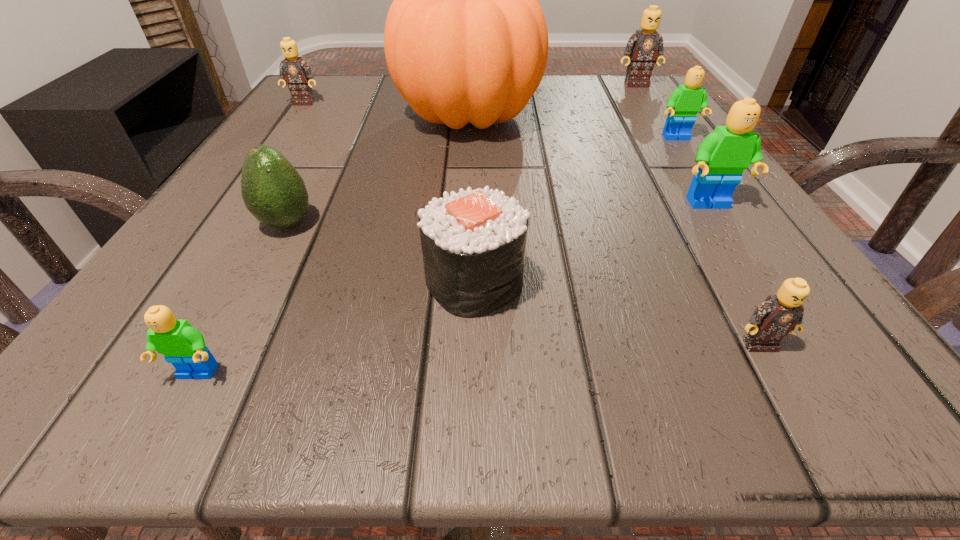
Identify the location of avocado. This screenshot has height=540, width=960. (273, 191).

Where is `the third nearest object`? Image resolution: width=960 pixels, height=540 pixels. the third nearest object is located at coordinates (473, 242).

Image resolution: width=960 pixels, height=540 pixels. I want to click on the nearest tan Lego, so 778,315.

The height and width of the screenshot is (540, 960). In order to click on the smallest tan Lego in this screenshot , I will do (x=778, y=315).

Identify the location of the nearest object. (183, 346).

You are a GUI agent. You are given a task and a screenshot of the screen. Output one action in this format:
    pyautogui.click(x=<x>, y=<y>)
    Task: Click on the nearest green Lego
    Image resolution: width=960 pixels, height=540 pixels.
    Given the screenshot: What is the action you would take?
    pyautogui.click(x=183, y=346)

Locate an element on the screen. The height and width of the screenshot is (540, 960). vacant space situated on the right of the tallest object is located at coordinates (635, 116).

Locate an element on the screen. Image resolution: width=960 pixels, height=540 pixels. free space located 0.270m in front of the farthest tan Lego is located at coordinates (679, 149).

At what (x,y) coordinates should I click in order to perform the action: click on free space located on the face of the third nearest Lego. Please return your answer as a coordinate pair (x, y). Looking at the image, I should click on (812, 364).

Find the location of a particular element. The image size is (960, 540). blank area located 0.390m in front of the leftmost tan Lego is located at coordinates (219, 226).